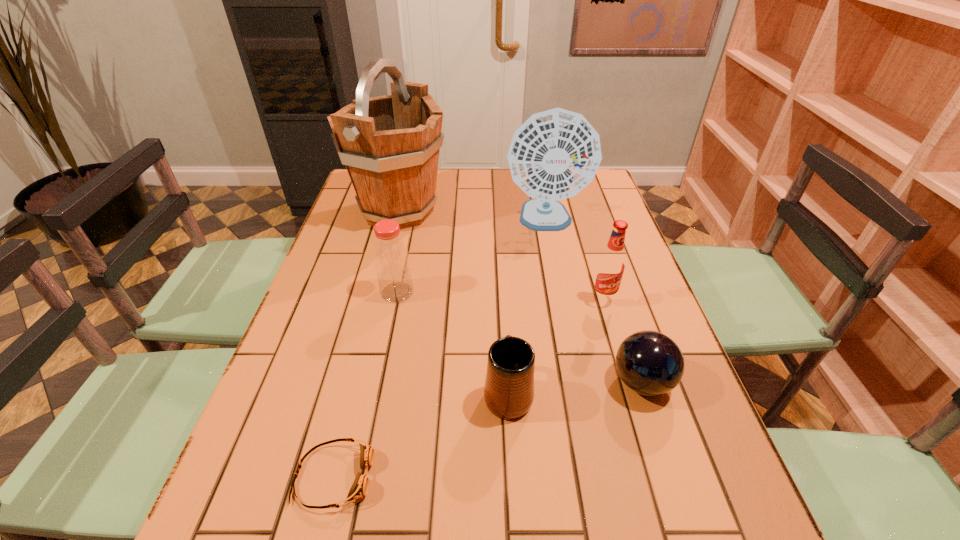
Identify the location of fan that is at the far edge. The width and height of the screenshot is (960, 540). (554, 154).

Where is `bucket that is at the left edge`? This screenshot has height=540, width=960. bucket that is at the left edge is located at coordinates (390, 144).

Where is `goggles at the left edge`? Image resolution: width=960 pixels, height=540 pixels. goggles at the left edge is located at coordinates (359, 489).

This screenshot has width=960, height=540. I want to click on fan at the right edge, so click(554, 154).

The height and width of the screenshot is (540, 960). Identify the location of root beer positioned at the right edge. (611, 264).

What are the coordinates of `bowling ball positioned at the right edge` in the screenshot? It's located at (650, 363).

Find the location of a particular element. object that is positioned at the far left corner is located at coordinates (390, 144).

Find the location of a particular element. The height and width of the screenshot is (540, 960). object at the far right corner is located at coordinates (554, 154).

Find the location of a particular element. The height and width of the screenshot is (540, 960). free region at the far edge is located at coordinates (452, 181).

This screenshot has height=540, width=960. I want to click on vacant space at the left edge of the desktop, so click(x=327, y=312).